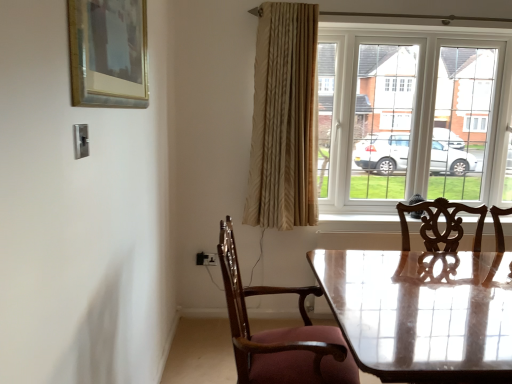
What do you see at coordinates (280, 334) in the screenshot? I see `wooden chair with upholstered seat at lower center` at bounding box center [280, 334].

The width and height of the screenshot is (512, 384). What do you see at coordinates (284, 119) in the screenshot?
I see `beige textured curtain at upper right` at bounding box center [284, 119].

You are a GUI agent. You are given a task and a screenshot of the screen. Output one action in this format:
    pyautogui.click(x=<x>, y=<y>)
    Task: Click on the white glass window at upper right
    Image resolution: width=512 pixels, height=384 pixels.
    Given the screenshot: What is the action you would take?
    pyautogui.click(x=413, y=113)

Who is shorter, white glass window at upper right or gold-framed painting at upper left?

gold-framed painting at upper left is shorter.

Considering the relative sizes of white glass window at upper right and gold-framed painting at upper left in the image provided, is white glass window at upper right smaller than gold-framed painting at upper left?

Actually, white glass window at upper right might be larger than gold-framed painting at upper left.

From the picture: From the image's perspective, is white glass window at upper right on gold-framed painting at upper left?

No.

Considering the sizes of white glass window at upper right and gold-framed painting at upper left in the image, is white glass window at upper right wider or thinner than gold-framed painting at upper left?

white glass window at upper right is wider than gold-framed painting at upper left.

In the scene shown: How different are the orientations of wooden chair with upholstered seat at lower center and white glass window at upper right in degrees?

The angular difference between wooden chair with upholstered seat at lower center and white glass window at upper right is 87.9 degrees.

Is wooden chair with upholstered seat at lower center aimed at white glass window at upper right?

No, wooden chair with upholstered seat at lower center is not aimed at white glass window at upper right.

Choose the correct answer: Is wooden chair with upholstered seat at lower center inside white glass window at upper right or outside it?

wooden chair with upholstered seat at lower center exists outside the volume of white glass window at upper right.

Can we say white glass window at upper right lies outside wooden chair with upholstered seat at lower center?

Yes, white glass window at upper right is located beyond the bounds of wooden chair with upholstered seat at lower center.

Is white glass window at upper right taller or shorter than wooden chair with upholstered seat at lower center?

Considering their sizes, white glass window at upper right has more height than wooden chair with upholstered seat at lower center.

Is white glass window at upper right facing away from wooden chair with upholstered seat at lower center?

No, white glass window at upper right is not facing the opposite direction of wooden chair with upholstered seat at lower center.

Looking at the image, does white glass window at upper right seem bigger or smaller compared to wooden chair with upholstered seat at lower center?

Clearly, white glass window at upper right is larger in size than wooden chair with upholstered seat at lower center.

From the image's perspective, which one is positioned lower, gold-framed painting at upper left or glossy wooden table at center?

glossy wooden table at center.

Would you say gold-framed painting at upper left is outside glossy wooden table at center?

That's correct, gold-framed painting at upper left is outside of glossy wooden table at center.

What are the coordinates of `picture frame in front of the glossy wooden table at center` in the screenshot? It's located at (108, 53).

Considering the relative positions of gold-framed painting at upper left and glossy wooden table at center in the image provided, is gold-framed painting at upper left to the left of glossy wooden table at center from the viewer's perspective?

Yes, gold-framed painting at upper left is to the left of glossy wooden table at center.

Between point (285, 64) and point (102, 58), which one is positioned in front?

The point (102, 58) is more forward.

Is beige textured curtain at upper right not close to gold-framed painting at upper left?

Yes.

Between beige textured curtain at upper right and gold-framed painting at upper left, which one has less height?

Standing shorter between the two is gold-framed painting at upper left.

Is beige textured curtain at upper right facing towards gold-framed painting at upper left?

Result: No, beige textured curtain at upper right does not turn towards gold-framed painting at upper left.

How many degrees apart are the facing directions of white glass window at upper right and glossy wooden table at center?

The facing directions of white glass window at upper right and glossy wooden table at center are 2.92 degrees apart.

Can you confirm if white glass window at upper right is thinner than glossy wooden table at center?

Yes.

Considering the sizes of objects white glass window at upper right and glossy wooden table at center in the image provided, who is smaller, white glass window at upper right or glossy wooden table at center?

glossy wooden table at center is smaller.

Can you confirm if glossy wooden table at center is smaller than wooden chair with upholstered seat at lower center?

Indeed, glossy wooden table at center has a smaller size compared to wooden chair with upholstered seat at lower center.

Does glossy wooden table at center contain wooden chair with upholstered seat at lower center?

That's incorrect, wooden chair with upholstered seat at lower center is not inside glossy wooden table at center.

Which object is thinner, glossy wooden table at center or wooden chair with upholstered seat at lower center?

glossy wooden table at center is thinner.

Find the location of a particular element. The height and width of the screenshot is (384, 512). picture frame on the left of white glass window at upper right is located at coordinates (108, 53).

I want to click on window lying above the wooden chair with upholstered seat at lower center (from the image's perspective), so click(413, 113).

From the image, which object appears to be nearer to gold-framed painting at upper left, glossy wooden table at center or wooden chair with upholstered seat at lower center?

wooden chair with upholstered seat at lower center.

Estimate the real-world distances between objects in this image. Which object is further from white glass window at upper right, glossy wooden table at center or wooden chair with upholstered seat at lower center?

wooden chair with upholstered seat at lower center.

When comparing their distances from wooden chair with upholstered seat at lower center, does glossy wooden table at center or gold-framed painting at upper left seem closer?

Among the two, glossy wooden table at center is located nearer to wooden chair with upholstered seat at lower center.

Which object lies further to the anchor point glossy wooden table at center, gold-framed painting at upper left or beige textured curtain at upper right?

gold-framed painting at upper left is positioned further to the anchor glossy wooden table at center.

Considering their positions, is glossy wooden table at center positioned closer to wooden chair with upholstered seat at lower center than white glass window at upper right?

Among the two, glossy wooden table at center is located nearer to wooden chair with upholstered seat at lower center.

Based on their spatial positions, is white glass window at upper right or gold-framed painting at upper left further from wooden chair with upholstered seat at lower center?

white glass window at upper right.

When comparing their distances from beige textured curtain at upper right, does gold-framed painting at upper left or wooden chair with upholstered seat at lower center seem further?

The object further to beige textured curtain at upper right is gold-framed painting at upper left.

When comparing their distances from beige textured curtain at upper right, does gold-framed painting at upper left or white glass window at upper right seem closer?

Among the two, white glass window at upper right is located nearer to beige textured curtain at upper right.

Image resolution: width=512 pixels, height=384 pixels. I want to click on table between gold-framed painting at upper left and white glass window at upper right in the horizontal direction, so click(422, 312).

The height and width of the screenshot is (384, 512). I want to click on table between beige textured curtain at upper right and wooden chair with upholstered seat at lower center in the up-down direction, so click(x=422, y=312).

Where is `table located between wooden chair with upholstered seat at lower center and white glass window at upper right in the depth direction`? Image resolution: width=512 pixels, height=384 pixels. table located between wooden chair with upholstered seat at lower center and white glass window at upper right in the depth direction is located at coordinates (422, 312).

Where is `table between gold-framed painting at upper left and beige textured curtain at upper right from front to back`? Image resolution: width=512 pixels, height=384 pixels. table between gold-framed painting at upper left and beige textured curtain at upper right from front to back is located at coordinates (422, 312).